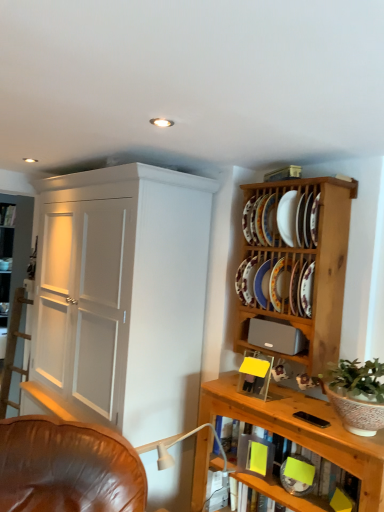
Question: From the image's perspective, is white painted wood cupboard at left below wooden plate rack at upper right, which is counted as the 1th shelf, starting from the top?

Choices:
 (A) no
 (B) yes

Answer: (B)

Question: From a real-world perspective, is white painted wood cupboard at left over wooden plate rack at upper right, which is counted as the 2th shelf, starting from the bottom?

Choices:
 (A) yes
 (B) no

Answer: (B)

Question: Is wooden plate rack at upper right, which is counted as the 2th shelf, starting from the bottom, inside white painted wood cupboard at left?

Choices:
 (A) no
 (B) yes

Answer: (A)

Question: Is white painted wood cupboard at left at the right side of wooden plate rack at upper right, which is counted as the 2th shelf, starting from the bottom?

Choices:
 (A) yes
 (B) no

Answer: (B)

Question: Would you consider white painted wood cupboard at left to be distant from wooden plate rack at upper right, which is counted as the 2th shelf, starting from the bottom?

Choices:
 (A) yes
 (B) no

Answer: (B)

Question: From the image's perspective, is white painted wood cupboard at left above wooden plate rack at upper right, which is counted as the 2th shelf, starting from the bottom?

Choices:
 (A) no
 (B) yes

Answer: (A)

Question: Would you say porcelain plate at upper right, arranged as the 5th platter when ordered from the bottom, is part of gray matte speaker at upper right's contents?

Choices:
 (A) no
 (B) yes

Answer: (A)

Question: Considering the relative sizes of gray matte speaker at upper right and porcelain plate at upper right, arranged as the first platter when viewed from the top, in the image provided, is gray matte speaker at upper right taller than porcelain plate at upper right, arranged as the first platter when viewed from the top,?

Choices:
 (A) yes
 (B) no

Answer: (B)

Question: From a real-world perspective, is gray matte speaker at upper right located beneath porcelain plate at upper right, arranged as the 5th platter when ordered from the bottom?

Choices:
 (A) yes
 (B) no

Answer: (A)

Question: Is gray matte speaker at upper right facing away from porcelain plate at upper right, arranged as the first platter when viewed from the top?

Choices:
 (A) yes
 (B) no

Answer: (B)

Question: Considering the relative positions of gray matte speaker at upper right and porcelain plate at upper right, arranged as the first platter when viewed from the top, in the image provided, is gray matte speaker at upper right to the right of porcelain plate at upper right, arranged as the first platter when viewed from the top, from the viewer's perspective?

Choices:
 (A) no
 (B) yes

Answer: (B)

Question: Considering the relative sizes of gray matte speaker at upper right and porcelain plate at upper right, arranged as the 5th platter when ordered from the bottom, in the image provided, is gray matte speaker at upper right smaller than porcelain plate at upper right, arranged as the 5th platter when ordered from the bottom,?

Choices:
 (A) yes
 (B) no

Answer: (B)

Question: From a real-world perspective, does green leafy plant in textured ceramic pot at right stand above porcelain plate at upper right, which ranks as the fifth platter in top-to-bottom order?

Choices:
 (A) no
 (B) yes

Answer: (A)